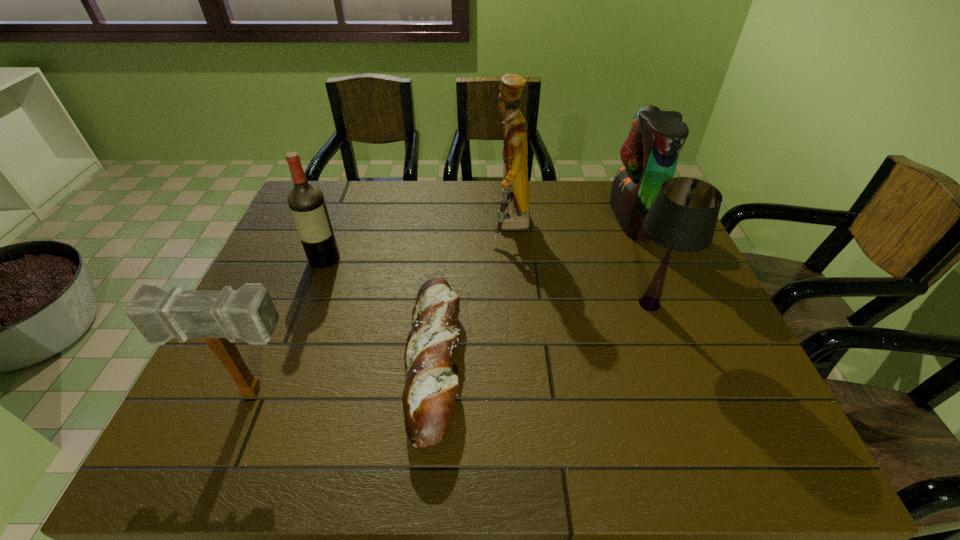
Locate an element on the screen. The height and width of the screenshot is (540, 960). the tallest object is located at coordinates (514, 213).

Where is `the third object from right to left`? This screenshot has height=540, width=960. the third object from right to left is located at coordinates (514, 213).

The width and height of the screenshot is (960, 540). Find the location of `parrot`. parrot is located at coordinates (650, 153).

Find the location of a particular element. lampshade is located at coordinates (x=683, y=217).

Image resolution: width=960 pixels, height=540 pixels. What are the coordinates of `the fourth nearest object` in the screenshot? It's located at (306, 202).

The width and height of the screenshot is (960, 540). What are the coordinates of `mallet` in the screenshot? It's located at (220, 317).

Identify the location of baguet. This screenshot has height=540, width=960. (430, 392).

This screenshot has width=960, height=540. Identify the location of the fourth object from right to left. (430, 392).

I want to click on vacant space located 0.100m on the front-facing side of the fourth object from left to right, so click(x=459, y=227).

Locate an element on the screen. The image size is (960, 540). vacant area situated on the front-facing side of the fourth object from left to right is located at coordinates (400, 227).